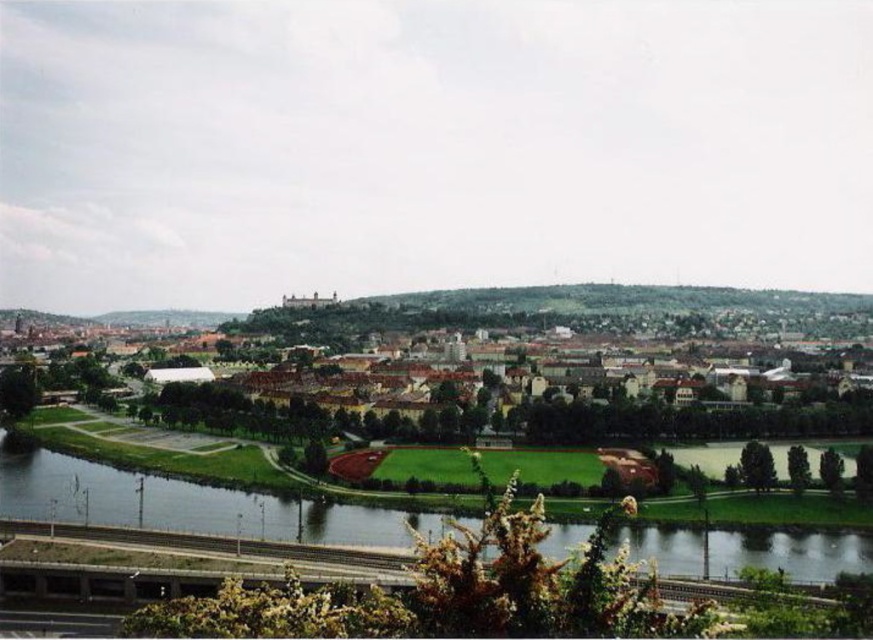
Question: Does green grassy field at center have a lesser width compared to green grass at lower center?

Choices:
 (A) no
 (B) yes

Answer: (A)

Question: Which point is farther to the camera?

Choices:
 (A) green grassy field at center
 (B) green grass at lower center

Answer: (A)

Question: Is green grassy field at center below green grass at lower center?

Choices:
 (A) no
 (B) yes

Answer: (A)

Question: Does green grassy field at center have a lesser width compared to green grass at lower center?

Choices:
 (A) yes
 (B) no

Answer: (B)